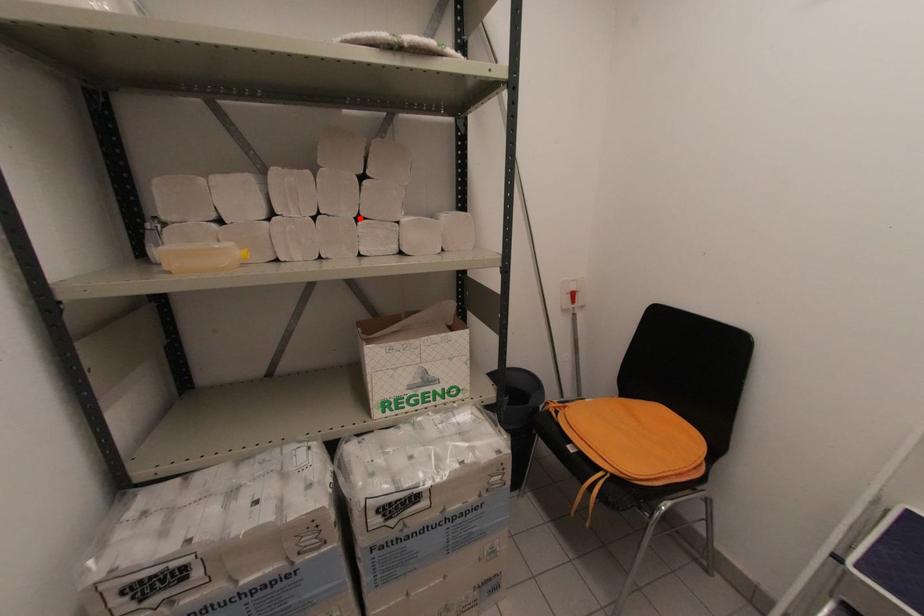
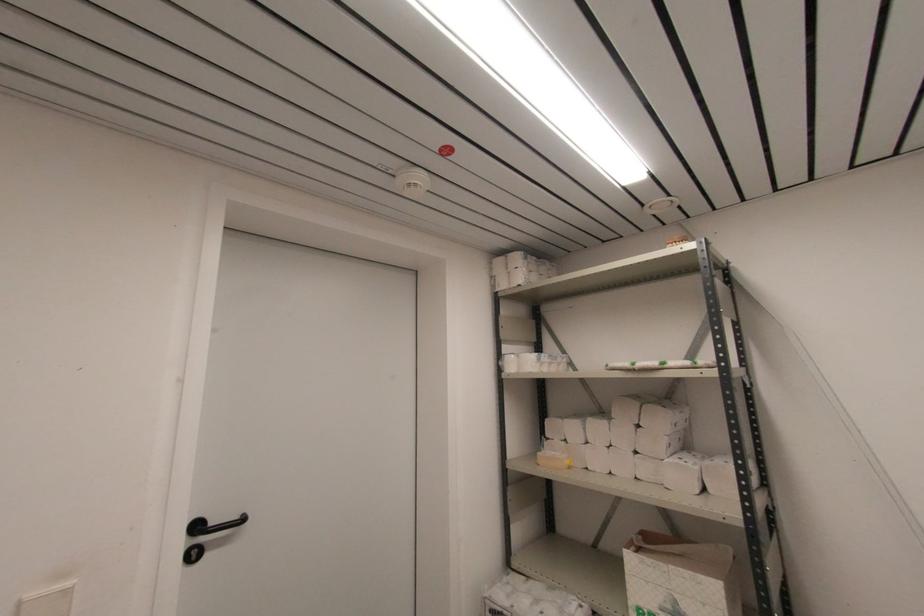
Where in the second image is the point corresponding to the highlighted location from the first image?

(637, 453)